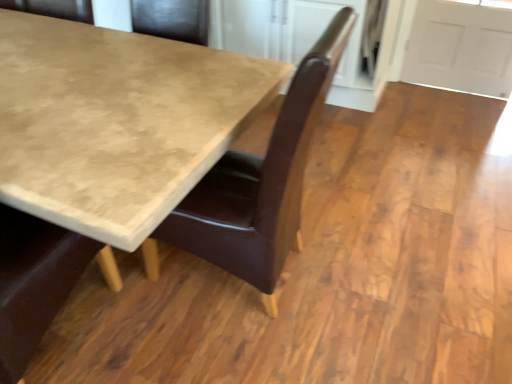
The image size is (512, 384). In order to click on free space above marble-like beige table at center (from a real-world perspective) in this screenshot , I will do `click(71, 77)`.